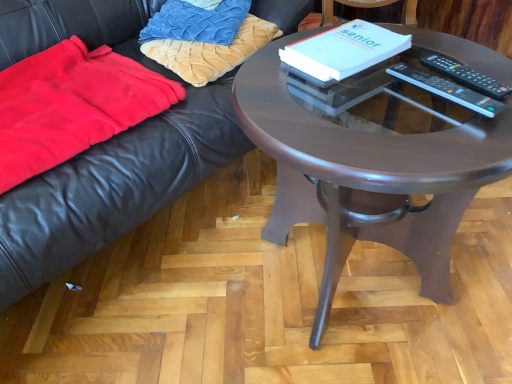
Question: Is black plastic remote control at upper right, placed as the 1th remote control when sorted from right to left, wider than velvet gold pillow at upper left, which is the 2th pillow in top-to-bottom order?

Choices:
 (A) yes
 (B) no

Answer: (B)

Question: Is black plastic remote control at upper right, which is the 2th remote control in left-to-right order, to the left of velvet gold pillow at upper left, positioned as the first pillow in bottom-to-top order, from the viewer's perspective?

Choices:
 (A) yes
 (B) no

Answer: (B)

Question: Considering the relative sizes of black plastic remote control at upper right, which is the 2th remote control in left-to-right order, and velvet gold pillow at upper left, which is the 2th pillow in top-to-bottom order, in the image provided, is black plastic remote control at upper right, which is the 2th remote control in left-to-right order, shorter than velvet gold pillow at upper left, which is the 2th pillow in top-to-bottom order,?

Choices:
 (A) yes
 (B) no

Answer: (A)

Question: Is black plastic remote control at upper right, which is the 2th remote control in left-to-right order, taller than velvet gold pillow at upper left, positioned as the first pillow in bottom-to-top order?

Choices:
 (A) no
 (B) yes

Answer: (A)

Question: Considering the relative positions of black plastic remote control at upper right, which is the 2th remote control in left-to-right order, and velvet gold pillow at upper left, which is the 2th pillow in top-to-bottom order, in the image provided, is black plastic remote control at upper right, which is the 2th remote control in left-to-right order, to the right of velvet gold pillow at upper left, which is the 2th pillow in top-to-bottom order, from the viewer's perspective?

Choices:
 (A) yes
 (B) no

Answer: (A)

Question: In terms of height, does white paper at center look taller or shorter compared to velvet gold pillow at upper left, positioned as the first pillow in bottom-to-top order?

Choices:
 (A) short
 (B) tall

Answer: (A)

Question: Is point (328, 64) closer or farther from the camera than point (271, 36)?

Choices:
 (A) closer
 (B) farther

Answer: (A)

Question: In the image, is white paper at center on the left side or the right side of velvet gold pillow at upper left, which is the 2th pillow in top-to-bottom order?

Choices:
 (A) right
 (B) left

Answer: (A)

Question: In terms of width, does white paper at center look wider or thinner when compared to velvet gold pillow at upper left, which is the 2th pillow in top-to-bottom order?

Choices:
 (A) wide
 (B) thin

Answer: (B)

Question: Considering the positions of black plastic remote control at right, positioned as the 2th remote control in right-to-left order, and velvet gold pillow at upper left, which is the 2th pillow in top-to-bottom order, in the image, is black plastic remote control at right, positioned as the 2th remote control in right-to-left order, wider or thinner than velvet gold pillow at upper left, which is the 2th pillow in top-to-bottom order,?

Choices:
 (A) thin
 (B) wide

Answer: (A)

Question: Considering their positions, is black plastic remote control at right, which is counted as the first remote control, starting from the left, located in front of or behind velvet gold pillow at upper left, which is the 2th pillow in top-to-bottom order?

Choices:
 (A) behind
 (B) front

Answer: (B)

Question: Looking at the image, does black plastic remote control at right, which is counted as the first remote control, starting from the left, seem bigger or smaller compared to velvet gold pillow at upper left, positioned as the first pillow in bottom-to-top order?

Choices:
 (A) big
 (B) small

Answer: (B)

Question: Is black plastic remote control at right, positioned as the 2th remote control in right-to-left order, inside or outside of velvet gold pillow at upper left, which is the 2th pillow in top-to-bottom order?

Choices:
 (A) outside
 (B) inside

Answer: (A)

Question: Relative to velvet gold pillow at upper left, positioned as the first pillow in bottom-to-top order, is black leather couch at upper left in front or behind?

Choices:
 (A) behind
 (B) front

Answer: (B)

Question: Based on their sizes in the image, would you say black leather couch at upper left is bigger or smaller than velvet gold pillow at upper left, positioned as the first pillow in bottom-to-top order?

Choices:
 (A) big
 (B) small

Answer: (A)